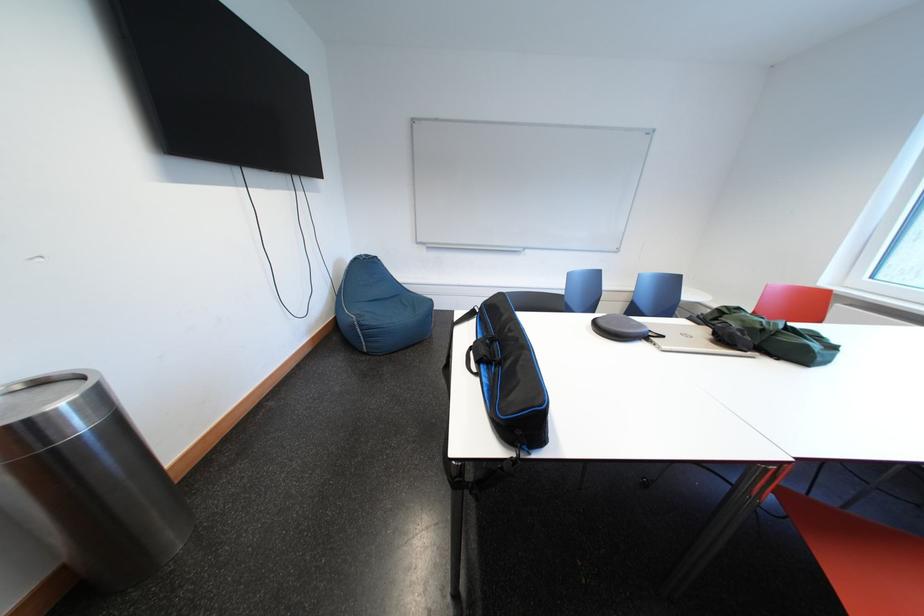
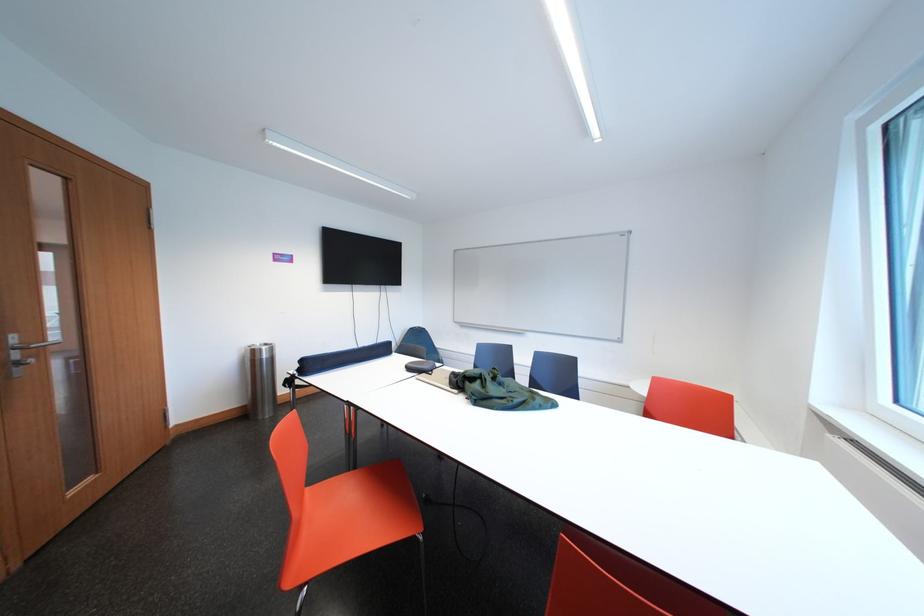
Question: I am providing you with two images of the same scene from different viewpoints. After the viewpoint changes to image2, which objects are now occluded?

Choices:
 (A) blue chair sitting surface
 (B) maroon pillow
 (C) long blue object
 (D) blue beanbag chair

Answer: (D)